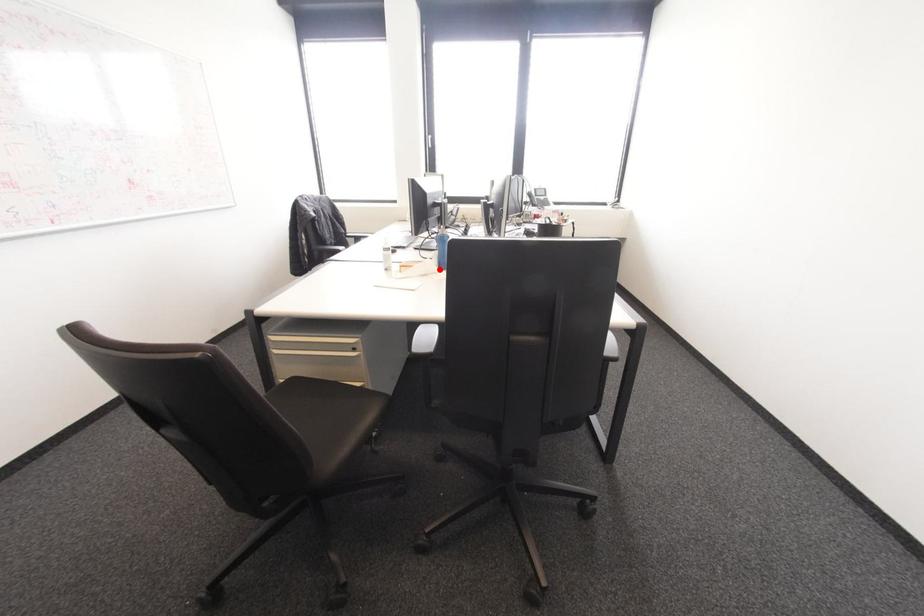
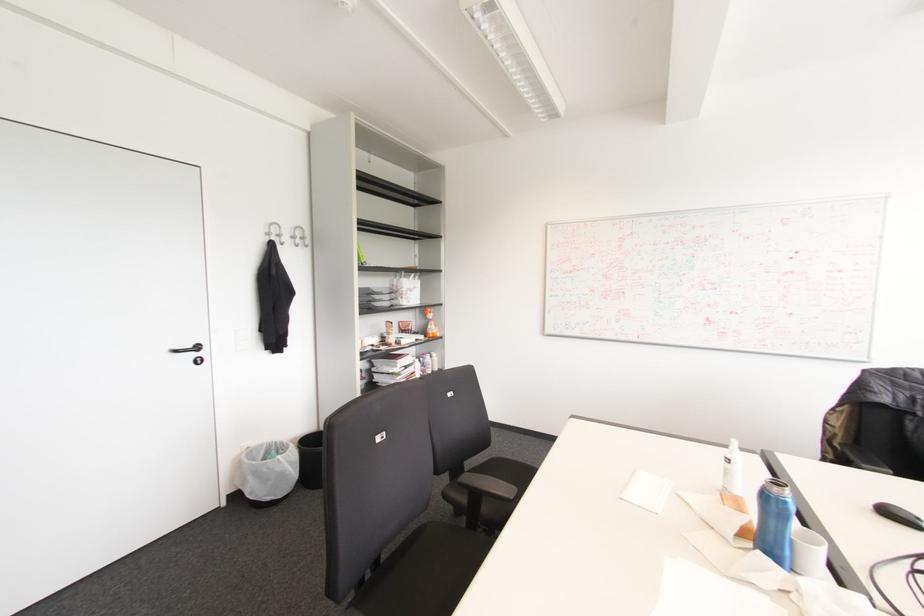
Where in the second image is the point corresponding to the highlighted location from the first image?

(757, 554)